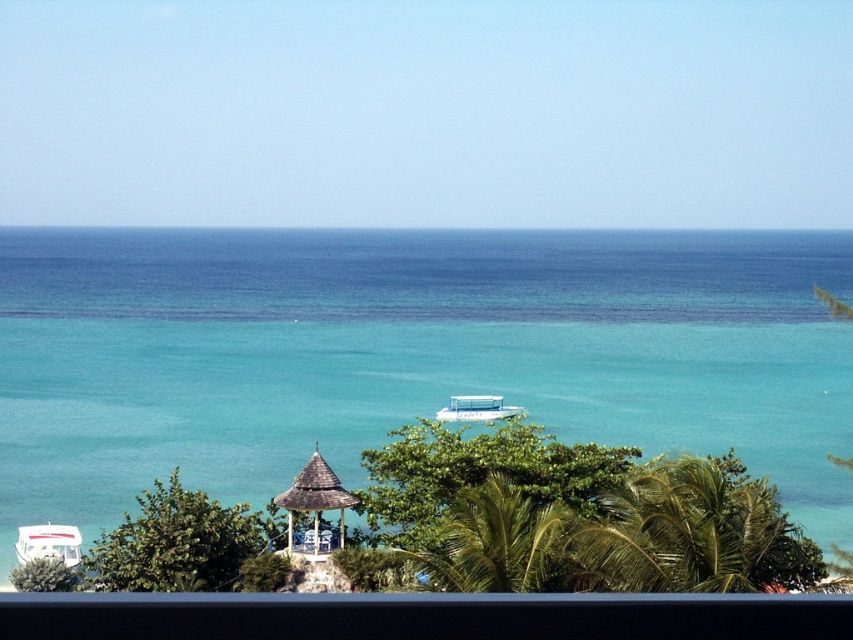
Question: Which point appears farthest from the camera in this image?

Choices:
 (A) (494, 397)
 (B) (450, 552)
 (C) (287, 509)
 (D) (143, 372)

Answer: (D)

Question: Among these objects, which one is nearest to the camera?

Choices:
 (A) white plastic boat at center
 (B) clear blue water at center

Answer: (B)

Question: Which object appears closest to the camera in this image?

Choices:
 (A) wooden gazebo at center
 (B) white plastic boat at center
 (C) clear blue water at center

Answer: (A)

Question: Where is clear blue water at center located in relation to white glossy boat at lower left in the image?

Choices:
 (A) right
 (B) left

Answer: (A)

Question: Is the position of white glossy boat at lower left more distant than that of white plastic boat at center?

Choices:
 (A) no
 (B) yes

Answer: (A)

Question: Where is green leafy palm tree at center located in relation to wooden gazebo at center in the image?

Choices:
 (A) below
 (B) above

Answer: (B)